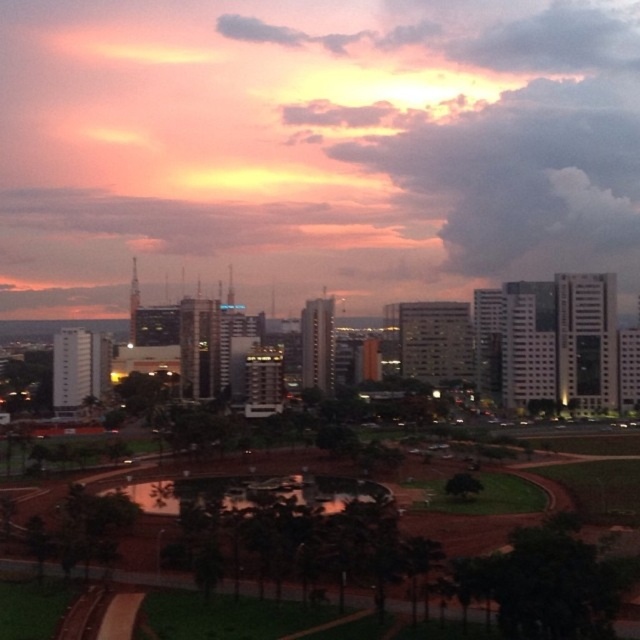
The image size is (640, 640). What do you see at coordinates (314, 148) in the screenshot? I see `matte orange sky at upper center` at bounding box center [314, 148].

Is matte orange sky at upper center closer to camera compared to green grass at center?

No, matte orange sky at upper center is behind green grass at center.

Who is more distant from viewer, (515, 252) or (534, 552)?

The point (515, 252) is more distant.

Locate an element on the screen. matte orange sky at upper center is located at coordinates (314, 148).